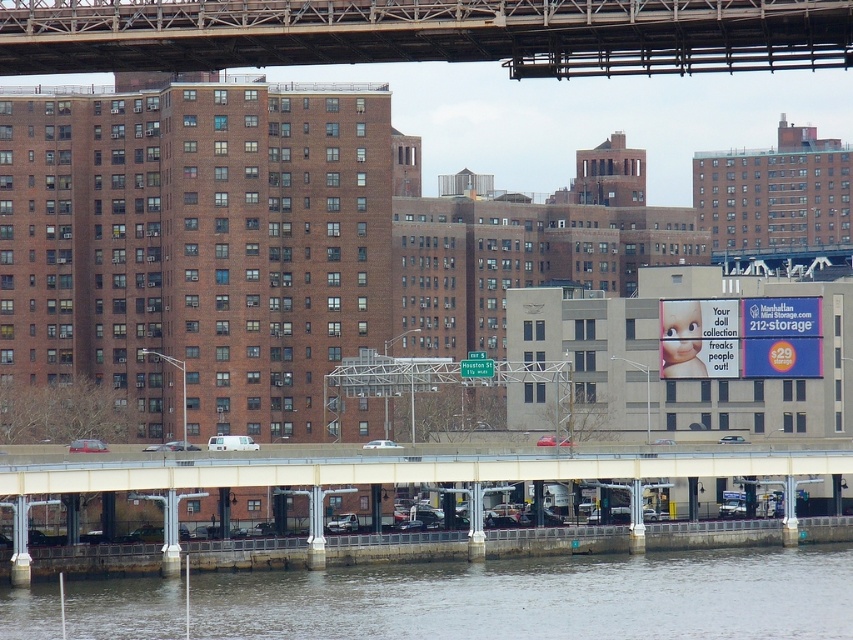
Is gray concrete river at lower center behind concrete bridge at lower center?

No.

Looking at this image, does gray concrete river at lower center have a larger size compared to concrete bridge at lower center?

Actually, gray concrete river at lower center might be smaller than concrete bridge at lower center.

Where is `gray concrete river at lower center`? gray concrete river at lower center is located at coordinates (541, 596).

Can you confirm if gray concrete river at lower center is bigger than metallic gray bridge at upper center?

Yes.

Is gray concrete river at lower center to the left of metallic gray bridge at upper center from the viewer's perspective?

No, gray concrete river at lower center is not to the left of metallic gray bridge at upper center.

The image size is (853, 640). Describe the element at coordinates (541, 596) in the screenshot. I see `gray concrete river at lower center` at that location.

The width and height of the screenshot is (853, 640). In order to click on gray concrete river at lower center in this screenshot , I will do `click(541, 596)`.

Is metallic gray bridge at upper center to the right of concrete bridge at lower center from the viewer's perspective?

Incorrect, metallic gray bridge at upper center is not on the right side of concrete bridge at lower center.

Between metallic gray bridge at upper center and concrete bridge at lower center, which one has less height?

metallic gray bridge at upper center

Identify the location of metallic gray bridge at upper center. (426, 35).